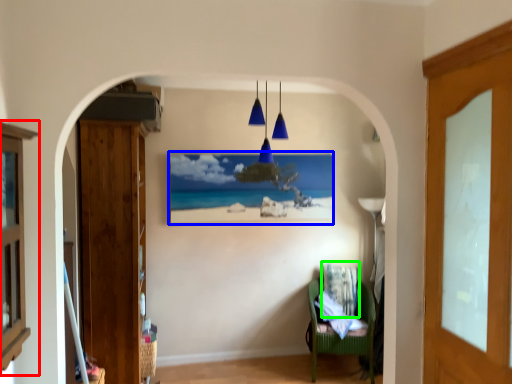
Question: Based on their relative distances, which object is farther from cabinetry (highlighted by a red box)? Choose from picture frame (highlighted by a blue box) and pillow (highlighted by a green box).

Choices:
 (A) picture frame
 (B) pillow

Answer: (B)